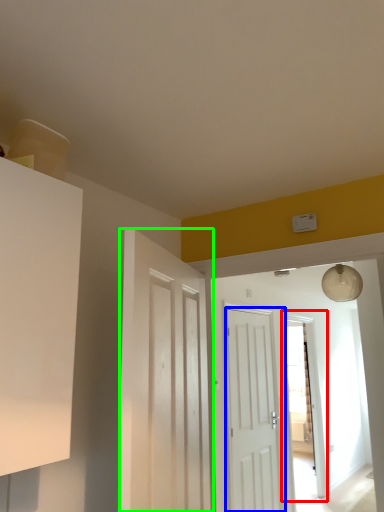
Question: Which is farther away from glass door (highlighted by a red box)? door (highlighted by a blue box) or door (highlighted by a green box)?

Choices:
 (A) door
 (B) door

Answer: (B)